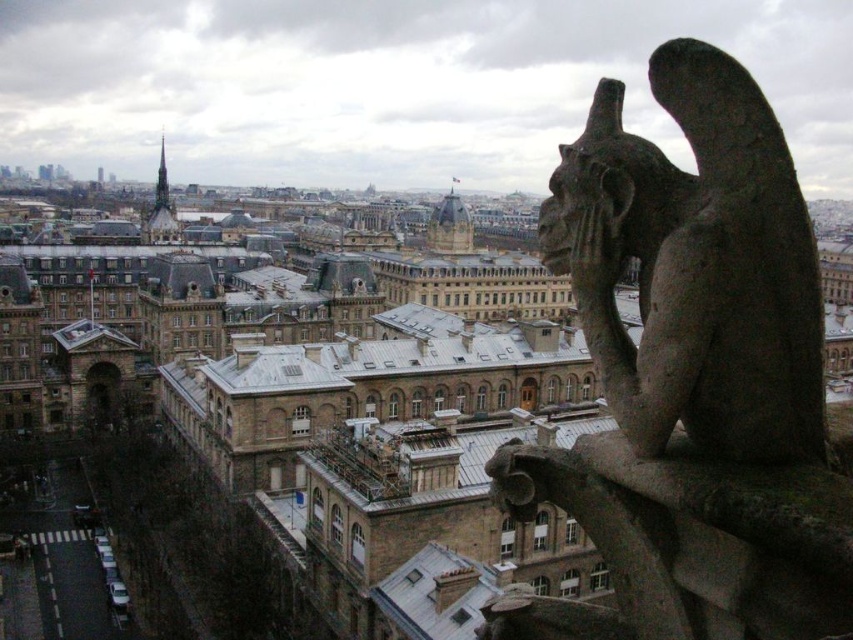
Question: Is dark gray stone gargoyle at upper right bigger than golden stone tower at center?

Choices:
 (A) yes
 (B) no

Answer: (B)

Question: Which object appears farthest from the camera in this image?

Choices:
 (A) golden stone tower at center
 (B) smooth gray stone tower at upper left
 (C) dark gray stone gargoyle at upper right

Answer: (A)

Question: Does dark gray stone gargoyle at upper right appear on the left side of golden stone tower at center?

Choices:
 (A) no
 (B) yes

Answer: (B)

Question: Considering the real-world distances, which object is farthest from the smooth gray stone tower at upper left?

Choices:
 (A) dark gray stone gargoyle at upper right
 (B) golden stone tower at center

Answer: (A)

Question: Which of these objects is positioned farthest from the dark gray stone gargoyle at upper right?

Choices:
 (A) smooth gray stone tower at upper left
 (B) golden stone tower at center

Answer: (B)

Question: Does golden stone tower at center come in front of smooth gray stone tower at upper left?

Choices:
 (A) yes
 (B) no

Answer: (B)